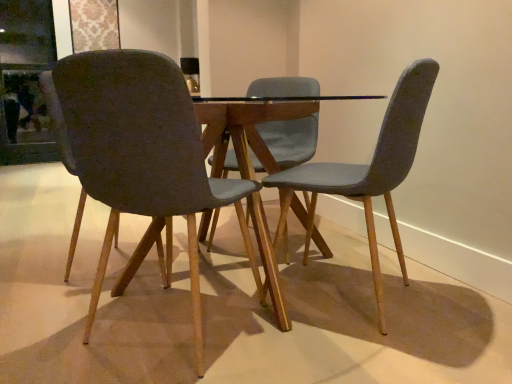
In order to click on textured gray chair at left, which is the first chair from left to right in this screenshot , I will do `click(143, 156)`.

Describe the element at coordinates (25, 81) in the screenshot. I see `transparent glass door at upper left` at that location.

The height and width of the screenshot is (384, 512). Find the location of `textured gray chair at center, which ranks as the 1th chair in right-to-left order`. textured gray chair at center, which ranks as the 1th chair in right-to-left order is located at coordinates (368, 169).

How different are the orientations of transparent glass door at upper left and textured gray chair at center, the second chair when ordered from left to right, in degrees?

The facing directions of transparent glass door at upper left and textured gray chair at center, the second chair when ordered from left to right, are 144 degrees apart.

Is point (1, 108) farther from viewer compared to point (349, 169)?

Yes, it is.

Is there a large distance between transparent glass door at upper left and textured gray chair at center, which ranks as the 1th chair in right-to-left order?

Indeed, transparent glass door at upper left is not near textured gray chair at center, which ranks as the 1th chair in right-to-left order.

Considering the relative sizes of transparent glass door at upper left and textured gray chair at center, which ranks as the 1th chair in right-to-left order, in the image provided, is transparent glass door at upper left shorter than textured gray chair at center, which ranks as the 1th chair in right-to-left order,?

No, transparent glass door at upper left is not shorter than textured gray chair at center, which ranks as the 1th chair in right-to-left order.

Is textured gray chair at center, the second chair when ordered from left to right, inside or outside of transparent glass door at upper left?

The correct answer is: outside.

Measure the distance between textured gray chair at center, which ranks as the 1th chair in right-to-left order, and transparent glass door at upper left.

textured gray chair at center, which ranks as the 1th chair in right-to-left order, is 3.59 meters from transparent glass door at upper left.

Does point (382, 297) appear closer or farther from the camera than point (51, 13)?

Point (382, 297).

Can you confirm if textured gray chair at center, which ranks as the 1th chair in right-to-left order, is thinner than transparent glass door at upper left?

Incorrect, the width of textured gray chair at center, which ranks as the 1th chair in right-to-left order, is not less than that of transparent glass door at upper left.

Is transparent glass door at upper left inside the boundaries of textured gray chair at left, which is the 2th chair in right-to-left order, or outside?

transparent glass door at upper left is not inside textured gray chair at left, which is the 2th chair in right-to-left order, it's outside.

Is transparent glass door at upper left behind textured gray chair at left, which is the first chair from left to right?

Yes.

Is transparent glass door at upper left facing away from textured gray chair at left, which is the 2th chair in right-to-left order?

No, transparent glass door at upper left is not facing away from textured gray chair at left, which is the 2th chair in right-to-left order.

Between textured gray chair at center, the second chair when ordered from left to right, and textured gray chair at left, which is the first chair from left to right, which one has more height?

With more height is textured gray chair at center, the second chair when ordered from left to right.

At what (x,y) coordinates should I click in order to perform the action: click on chair above the textured gray chair at center, the second chair when ordered from left to right (from a real-world perspective). Please return your answer as a coordinate pair (x, y). The image size is (512, 384). Looking at the image, I should click on (143, 156).

Which object is wider, textured gray chair at center, the second chair when ordered from left to right, or textured gray chair at left, which is the first chair from left to right?

Wider between the two is textured gray chair at left, which is the first chair from left to right.

Which is in front, textured gray chair at center, which ranks as the 1th chair in right-to-left order, or textured gray chair at left, which is the 2th chair in right-to-left order?

textured gray chair at left, which is the 2th chair in right-to-left order, is closer to the camera.

Is textured gray chair at left, which is the 2th chair in right-to-left order, positioned in front of textured gray chair at center, which ranks as the 1th chair in right-to-left order?

Yes.

Looking at this image, from the image's perspective, between textured gray chair at left, which is the 2th chair in right-to-left order, and textured gray chair at center, the second chair when ordered from left to right, which one is located above?

From the image's view, textured gray chair at center, the second chair when ordered from left to right, is above.

How distant is textured gray chair at left, which is the 2th chair in right-to-left order, from textured gray chair at center, the second chair when ordered from left to right?

17.71 inches.

Looking at this image, which of these two, textured gray chair at left, which is the first chair from left to right, or transparent glass door at upper left, is bigger?

textured gray chair at left, which is the first chair from left to right, is bigger.

There is a textured gray chair at left, which is the first chair from left to right. Where is `glass door above it (from a real-world perspective)`? This screenshot has width=512, height=384. glass door above it (from a real-world perspective) is located at coordinates (25, 81).

Which is behind, point (192, 161) or point (35, 42)?

The point (35, 42) is more distant.

From a real-world perspective, is textured gray chair at left, which is the 2th chair in right-to-left order, physically located above or below transparent glass door at upper left?

textured gray chair at left, which is the 2th chair in right-to-left order, is below transparent glass door at upper left.

Locate an element on the screen. This screenshot has width=512, height=384. the 1st chair in front when counting from the transparent glass door at upper left is located at coordinates (368, 169).

This screenshot has height=384, width=512. In order to click on glass door on the left of textured gray chair at center, the second chair when ordered from left to right in this screenshot , I will do `click(25, 81)`.

Estimate the real-world distances between objects in this image. Which object is closer to transparent glass door at upper left, textured gray chair at center, which ranks as the 1th chair in right-to-left order, or textured gray chair at left, which is the 2th chair in right-to-left order?

textured gray chair at left, which is the 2th chair in right-to-left order, is positioned closer to the anchor transparent glass door at upper left.

From the picture: Looking at the image, which one is located further to textured gray chair at center, the second chair when ordered from left to right, transparent glass door at upper left or textured gray chair at left, which is the first chair from left to right?

transparent glass door at upper left is positioned further to the anchor textured gray chair at center, the second chair when ordered from left to right.

Considering their positions, is textured gray chair at left, which is the 2th chair in right-to-left order, positioned further to textured gray chair at center, the second chair when ordered from left to right, than transparent glass door at upper left?

transparent glass door at upper left.

Considering their positions, is textured gray chair at center, the second chair when ordered from left to right, positioned closer to textured gray chair at left, which is the 2th chair in right-to-left order, than transparent glass door at upper left?

Based on the image, textured gray chair at center, the second chair when ordered from left to right, appears to be nearer to textured gray chair at left, which is the 2th chair in right-to-left order.

Based on their spatial positions, is textured gray chair at left, which is the 2th chair in right-to-left order, or textured gray chair at center, which ranks as the 1th chair in right-to-left order, closer to transparent glass door at upper left?

Among the two, textured gray chair at left, which is the 2th chair in right-to-left order, is located nearer to transparent glass door at upper left.

Which object lies further to the anchor point textured gray chair at left, which is the first chair from left to right, transparent glass door at upper left or textured gray chair at center, which ranks as the 1th chair in right-to-left order?

The object further to textured gray chair at left, which is the first chair from left to right, is transparent glass door at upper left.

At what (x,y) coordinates should I click in order to perform the action: click on chair positioned between textured gray chair at left, which is the first chair from left to right, and transparent glass door at upper left from near to far. Please return your answer as a coordinate pair (x, y). The height and width of the screenshot is (384, 512). Looking at the image, I should click on (368, 169).